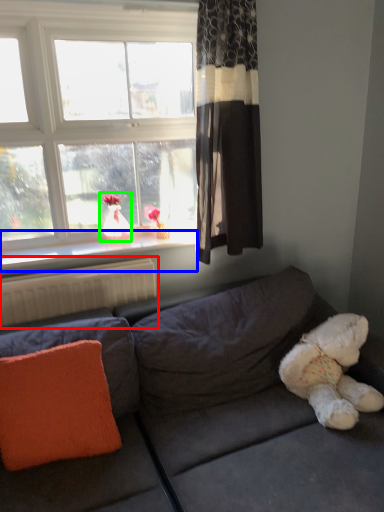
Question: Based on their relative distances, which object is farther from radiator (highlighted by a red box)? Choose from window sill (highlighted by a blue box) and doll (highlighted by a green box).

Choices:
 (A) window sill
 (B) doll

Answer: (B)